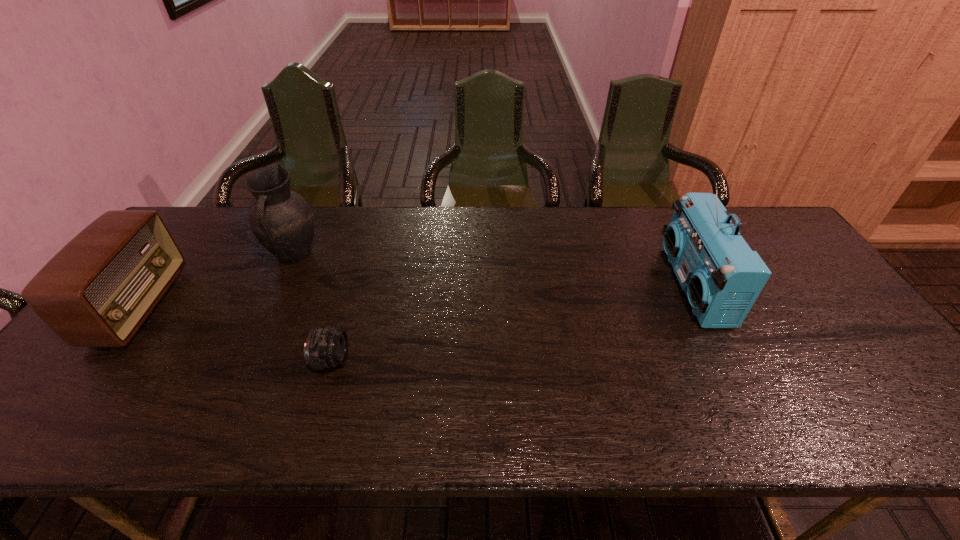
Where is `vacant position located on the side of the third object from right to left with the handle`? The image size is (960, 540). vacant position located on the side of the third object from right to left with the handle is located at coordinates (258, 329).

Where is `free space located on the front-facing side of the left radio receiver`? This screenshot has width=960, height=540. free space located on the front-facing side of the left radio receiver is located at coordinates (226, 306).

Locate an element on the screen. vacant region located 0.210m at the front element of the telephoto lens is located at coordinates (435, 360).

The height and width of the screenshot is (540, 960). Find the location of `radio receiver located at the far edge`. radio receiver located at the far edge is located at coordinates [x=722, y=277].

At what (x,y) coordinates should I click in order to perform the action: click on pitcher that is at the far edge. Please return your answer as a coordinate pair (x, y). This screenshot has height=540, width=960. Looking at the image, I should click on (282, 220).

This screenshot has width=960, height=540. I want to click on object that is positioned at the left edge, so click(x=97, y=291).

This screenshot has height=540, width=960. I want to click on free region at the far edge, so click(x=315, y=228).

Identify the location of vacant area at the near edge of the desktop. (137, 413).

In the image, there is a desktop. Identify the location of vacant space at the left edge. (81, 376).

In order to click on free space at the far left corner of the desktop in this screenshot , I will do `click(206, 219)`.